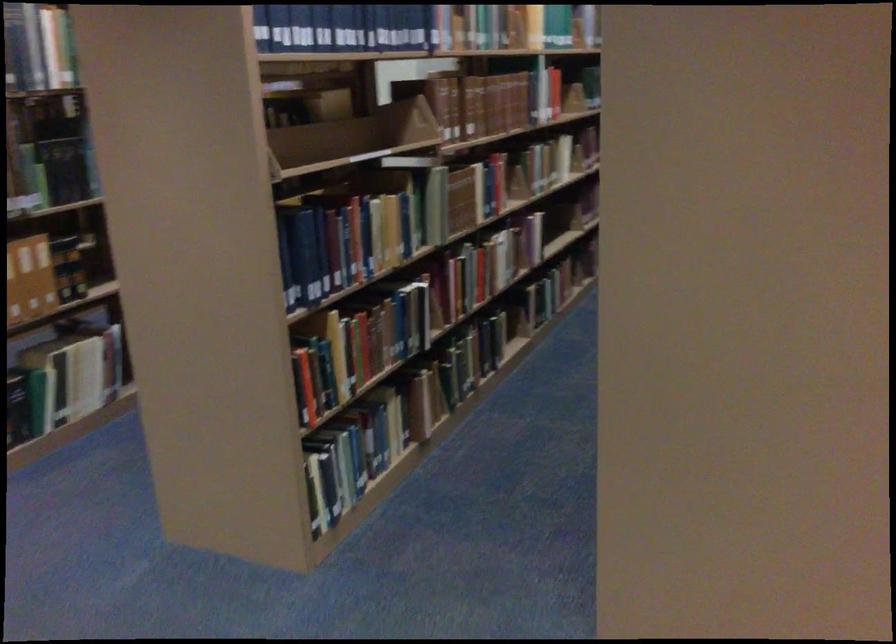
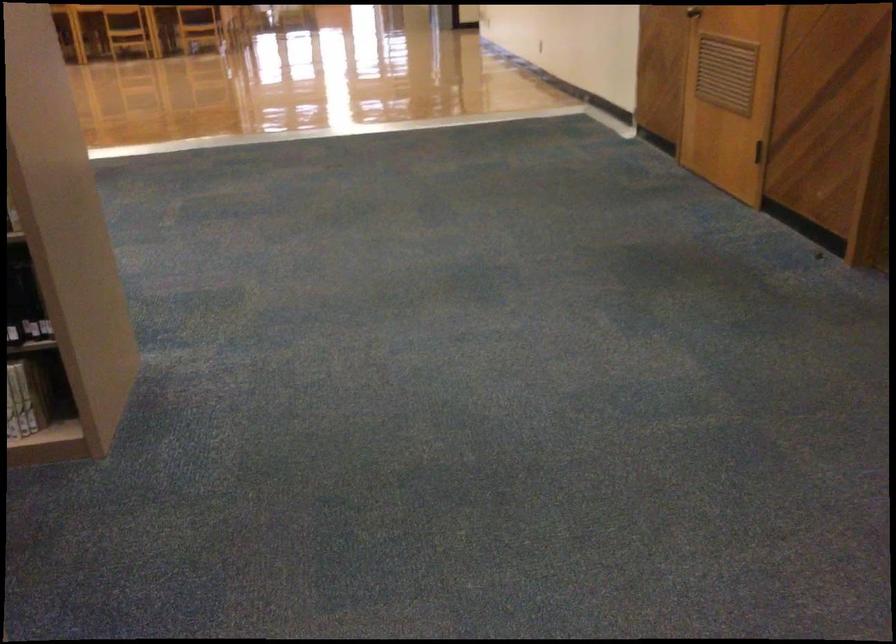
The point at (655, 430) is marked in the first image. Where is the corresponding point in the second image?

(23, 299)